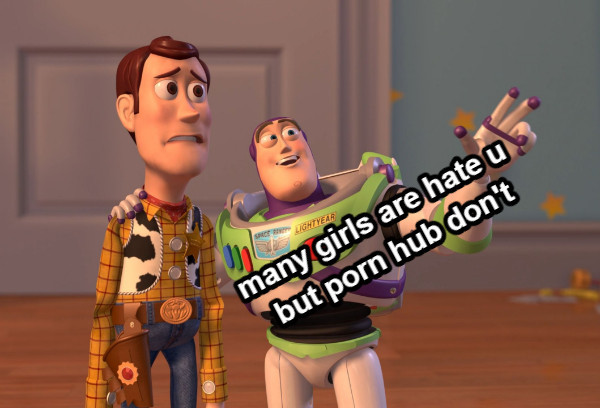
Where is `door`? The width and height of the screenshot is (600, 408). door is located at coordinates (75, 99).